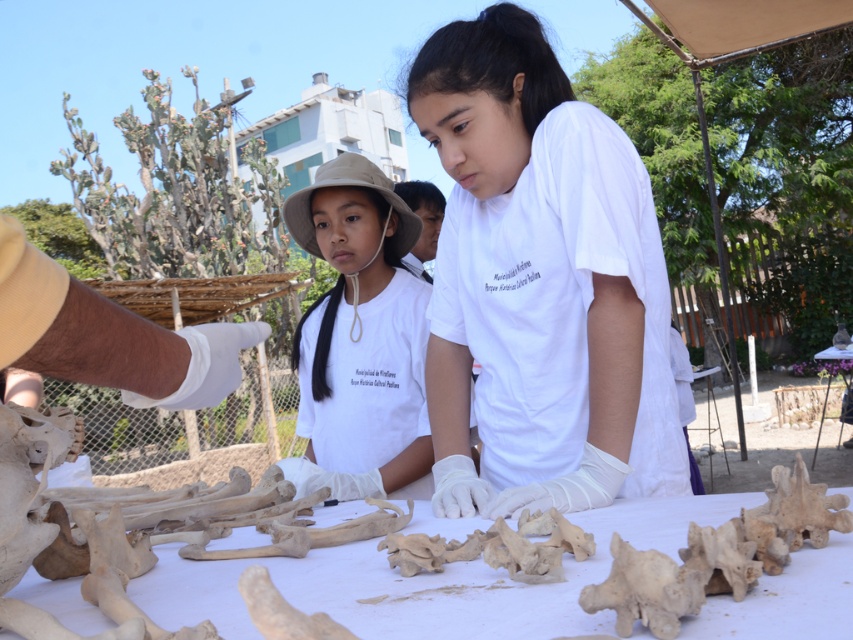
Can you confirm if white cotton shirt at center is positioned above white porous bone at center?

Yes.

Is white cotton shirt at center smaller than white porous bone at center?

Incorrect, white cotton shirt at center is not smaller in size than white porous bone at center.

Find the location of `white cotton shirt at center`. white cotton shirt at center is located at coordinates (358, 337).

Does point (537, 204) come closer to viewer compared to point (509, 632)?

No, (537, 204) is behind (509, 632).

Is white matte shirt at center smaller than bone-white bone at center?

Incorrect, white matte shirt at center is not smaller in size than bone-white bone at center.

Is point (488, 124) closer to camera compared to point (339, 588)?

No.

At what (x,y) coordinates should I click in order to perform the action: click on white matte shirt at center. Please return your answer as a coordinate pair (x, y). Looking at the image, I should click on (540, 284).

Is bone-white bone at center to the right of white plastic table at center from the viewer's perspective?

Incorrect, bone-white bone at center is not on the right side of white plastic table at center.

Can you confirm if bone-white bone at center is positioned below white plastic table at center?

No, bone-white bone at center is not below white plastic table at center.

Locate an element on the screen. bone-white bone at center is located at coordinates (427, 580).